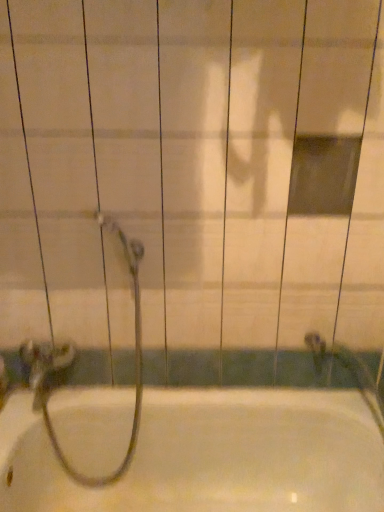
What do you see at coordinates (136, 367) in the screenshot? The image size is (384, 512). I see `metallic silver garden hose at lower left` at bounding box center [136, 367].

Where is `metallic silver garden hose at lower left`? This screenshot has height=512, width=384. metallic silver garden hose at lower left is located at coordinates (136, 367).

This screenshot has width=384, height=512. I want to click on white glossy bathtub at center, so click(214, 455).

The height and width of the screenshot is (512, 384). What do you see at coordinates (214, 455) in the screenshot?
I see `white glossy bathtub at center` at bounding box center [214, 455].

The width and height of the screenshot is (384, 512). Find the location of `metallic silver garden hose at lower left`. metallic silver garden hose at lower left is located at coordinates (136, 367).

Which object is positioned more to the right, metallic silver garden hose at lower left or white glossy bathtub at center?

Positioned to the right is white glossy bathtub at center.

Which object is closer to the camera taking this photo, metallic silver garden hose at lower left or white glossy bathtub at center?

Positioned in front is white glossy bathtub at center.

Considering the points (137, 260) and (359, 441), which point is in front, point (137, 260) or point (359, 441)?

The point (137, 260) is closer.

From the image's perspective, is metallic silver garden hose at lower left on white glossy bathtub at center?

→ Yes, from the image's perspective, metallic silver garden hose at lower left is over white glossy bathtub at center.

From a real-world perspective, between metallic silver garden hose at lower left and white glossy bathtub at center, who is vertically lower?

white glossy bathtub at center.

Does metallic silver garden hose at lower left have a lesser width compared to white glossy bathtub at center?

Yes, metallic silver garden hose at lower left is thinner than white glossy bathtub at center.

Does metallic silver garden hose at lower left have a lesser height compared to white glossy bathtub at center?

No.

Does metallic silver garden hose at lower left have a larger size compared to white glossy bathtub at center?

No, metallic silver garden hose at lower left is not bigger than white glossy bathtub at center.

From the picture: Is metallic silver garden hose at lower left surrounding white glossy bathtub at center?

No, metallic silver garden hose at lower left does not contain white glossy bathtub at center.

Is metallic silver garden hose at lower left directly adjacent to white glossy bathtub at center?

No, metallic silver garden hose at lower left is not in contact with white glossy bathtub at center.

Is metallic silver garden hose at lower left positioned with its back to white glossy bathtub at center?

No, metallic silver garden hose at lower left's orientation is not away from white glossy bathtub at center.

Locate an element on the screen. Image resolution: width=384 pixels, height=512 pixels. bathtub in front of the metallic silver garden hose at lower left is located at coordinates (214, 455).

Between white glossy bathtub at center and metallic silver garden hose at lower left, which one appears on the right side from the viewer's perspective?

From the viewer's perspective, white glossy bathtub at center appears more on the right side.

Relative to metallic silver garden hose at lower left, is white glossy bathtub at center in front or behind?

white glossy bathtub at center is positioned closer to the viewer than metallic silver garden hose at lower left.

Which is closer, (316, 495) or (136, 418)?

The point (316, 495) is more forward.

From the image's perspective, between white glossy bathtub at center and metallic silver garden hose at lower left, which one is located above?

metallic silver garden hose at lower left is shown above in the image.

From a real-world perspective, which is physically below, white glossy bathtub at center or metallic silver garden hose at lower left?

white glossy bathtub at center.

Does white glossy bathtub at center have a greater width compared to metallic silver garden hose at lower left?

Correct, the width of white glossy bathtub at center exceeds that of metallic silver garden hose at lower left.

From the picture: Considering the relative sizes of white glossy bathtub at center and metallic silver garden hose at lower left in the image provided, is white glossy bathtub at center taller than metallic silver garden hose at lower left?

In fact, white glossy bathtub at center may be shorter than metallic silver garden hose at lower left.

Which of these two, white glossy bathtub at center or metallic silver garden hose at lower left, is smaller?

metallic silver garden hose at lower left.

Is white glossy bathtub at center inside the boundaries of metallic silver garden hose at lower left, or outside?

white glossy bathtub at center exists outside the volume of metallic silver garden hose at lower left.

Is there a large distance between white glossy bathtub at center and metallic silver garden hose at lower left?

Actually, white glossy bathtub at center and metallic silver garden hose at lower left are a little close together.

Is white glossy bathtub at center oriented away from metallic silver garden hose at lower left?

No.

Where is `garden hose on the left side of white glossy bathtub at center`? The height and width of the screenshot is (512, 384). garden hose on the left side of white glossy bathtub at center is located at coordinates (136, 367).

Identify the location of garden hose to the left of white glossy bathtub at center. The width and height of the screenshot is (384, 512). (136, 367).

I want to click on bathtub below the metallic silver garden hose at lower left (from a real-world perspective), so click(x=214, y=455).